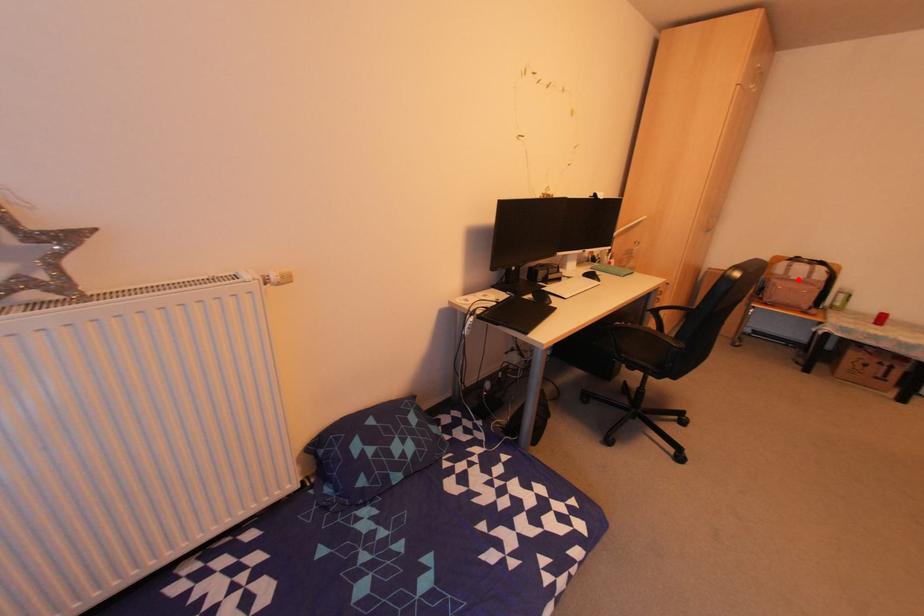
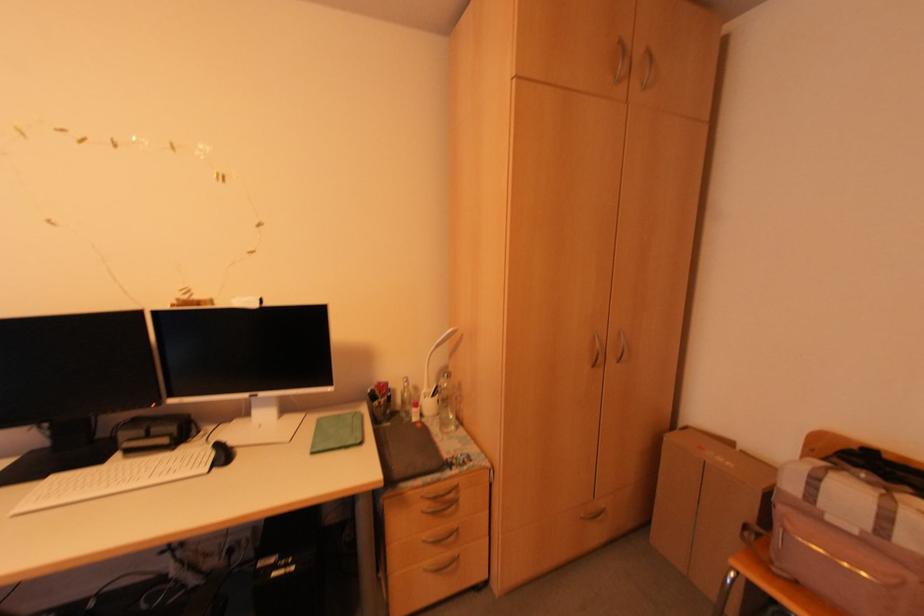
Question: I am providing you with two images of the same scene from different viewpoints. A red point is marked on the first image. At the location where the point appears in image 1, is it still visible in image 2?

Choices:
 (A) Yes
 (B) No

Answer: (A)